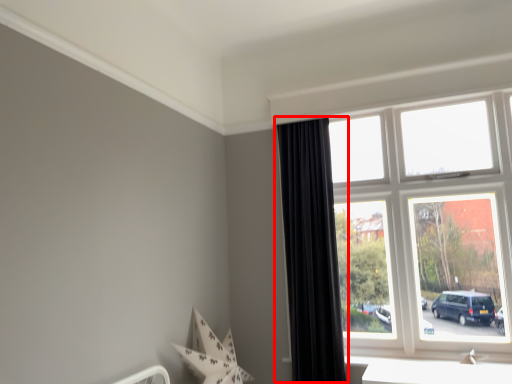
Question: In this image, where is curtain (annotated by the red box) located relative to window?

Choices:
 (A) right
 (B) left

Answer: (B)